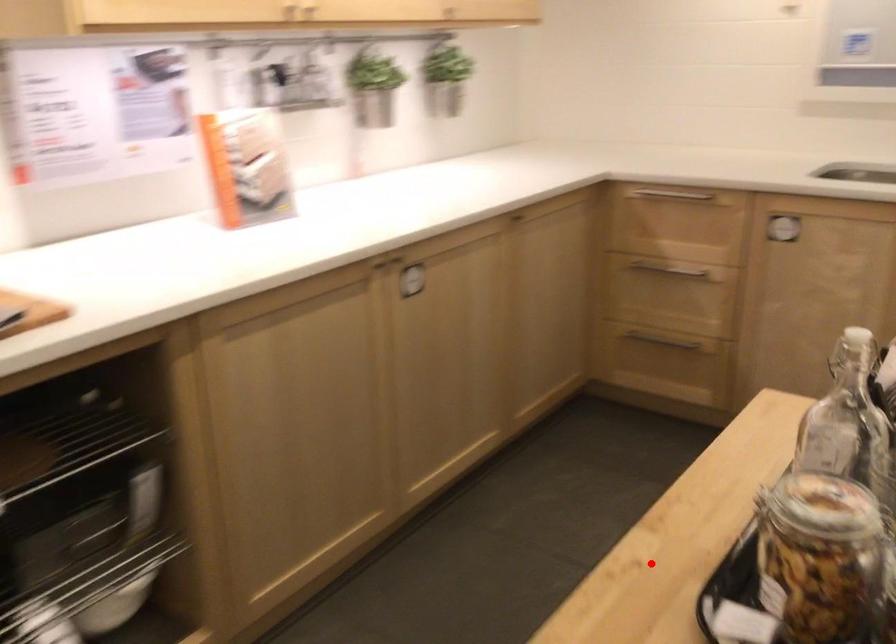
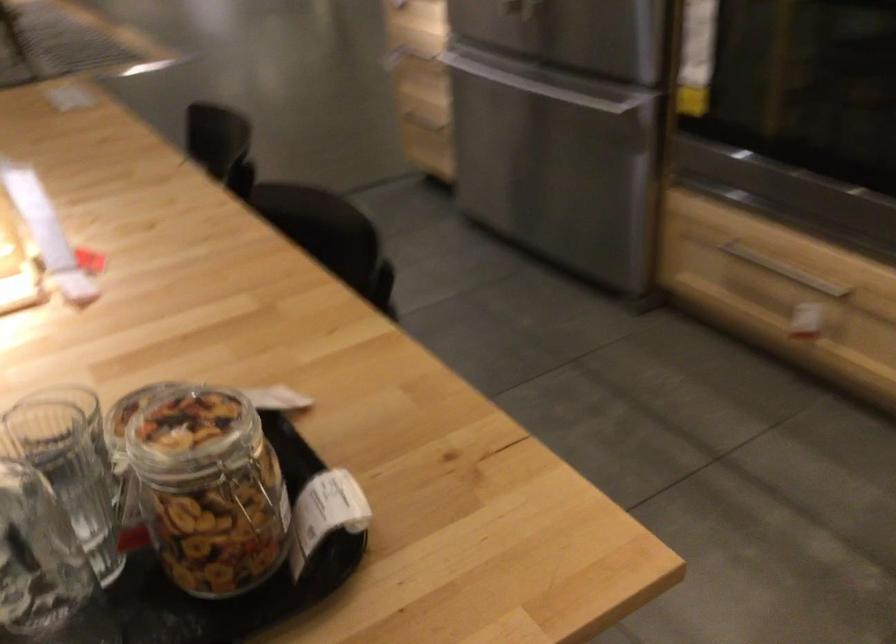
Locate, in the second image, the point that corresponds to the highlighted location in the first image.

(250, 493)